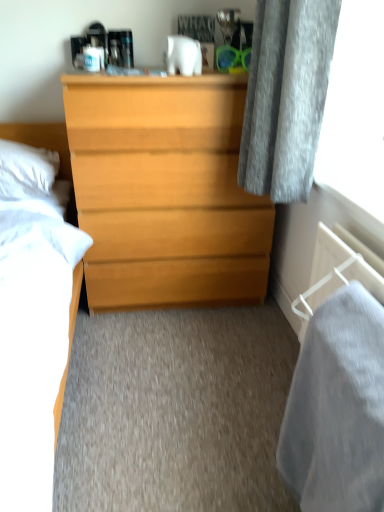
Question: Is gray soft fabric at lower right positioned behind light wood chest of drawers at center?

Choices:
 (A) no
 (B) yes

Answer: (A)

Question: From the image's perspective, is gray soft fabric at lower right on top of light wood chest of drawers at center?

Choices:
 (A) yes
 (B) no

Answer: (B)

Question: Is gray soft fabric at lower right bigger than light wood chest of drawers at center?

Choices:
 (A) no
 (B) yes

Answer: (A)

Question: Is gray soft fabric at lower right aimed at light wood chest of drawers at center?

Choices:
 (A) no
 (B) yes

Answer: (A)

Question: Considering the relative sizes of gray soft fabric at lower right and light wood chest of drawers at center in the image provided, is gray soft fabric at lower right shorter than light wood chest of drawers at center?

Choices:
 (A) no
 (B) yes

Answer: (B)

Question: Is gray soft fabric at lower right not inside light wood chest of drawers at center?

Choices:
 (A) no
 (B) yes

Answer: (B)

Question: Is light wood chest of drawers at center placed right next to gray soft fabric at lower right?

Choices:
 (A) no
 (B) yes

Answer: (A)

Question: Does light wood chest of drawers at center have a lesser width compared to gray soft fabric at lower right?

Choices:
 (A) yes
 (B) no

Answer: (B)

Question: Does light wood chest of drawers at center have a smaller size compared to gray soft fabric at lower right?

Choices:
 (A) yes
 (B) no

Answer: (B)

Question: From a real-world perspective, is light wood chest of drawers at center beneath gray soft fabric at lower right?

Choices:
 (A) yes
 (B) no

Answer: (B)

Question: Is light wood chest of drawers at center located outside gray soft fabric at lower right?

Choices:
 (A) no
 (B) yes

Answer: (B)

Question: Does light wood chest of drawers at center appear on the right side of gray soft fabric at lower right?

Choices:
 (A) no
 (B) yes

Answer: (A)

Question: Would you say gray soft fabric at lower right is a long distance from white soft pillow at left?

Choices:
 (A) yes
 (B) no

Answer: (A)